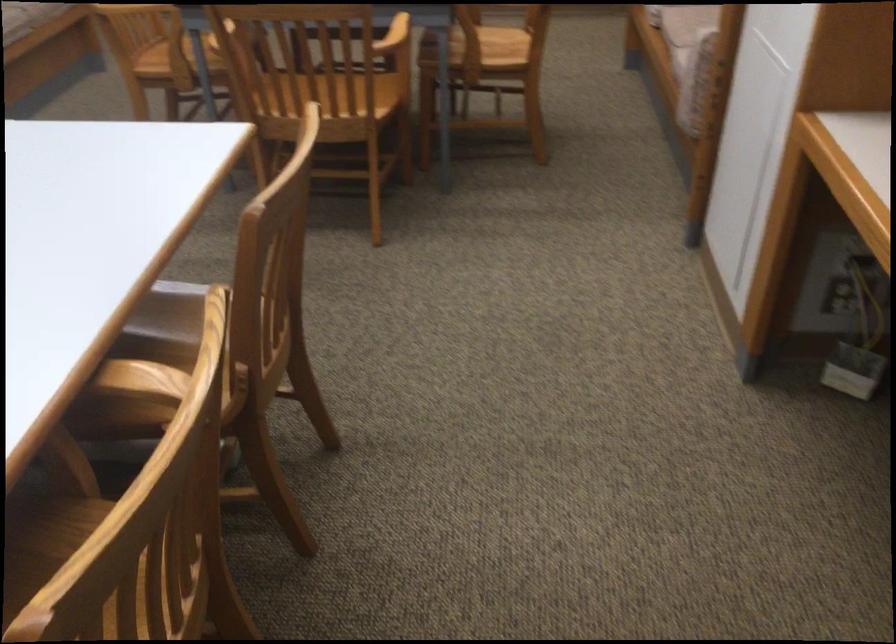
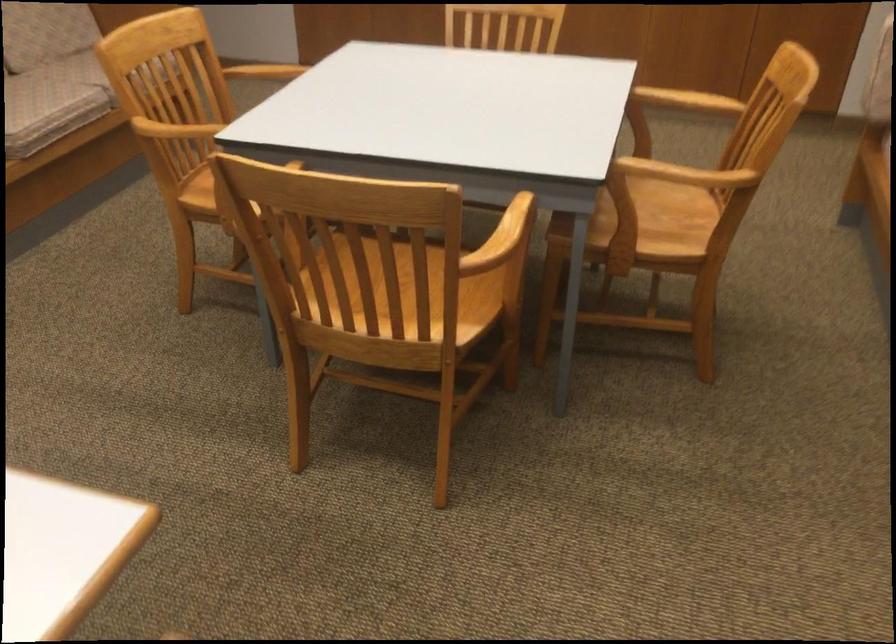
Question: In a continuous first-person perspective shot, in which direction is the camera moving?

Choices:
 (A) Left
 (B) Right
 (C) Forward
 (D) Backward

Answer: (C)